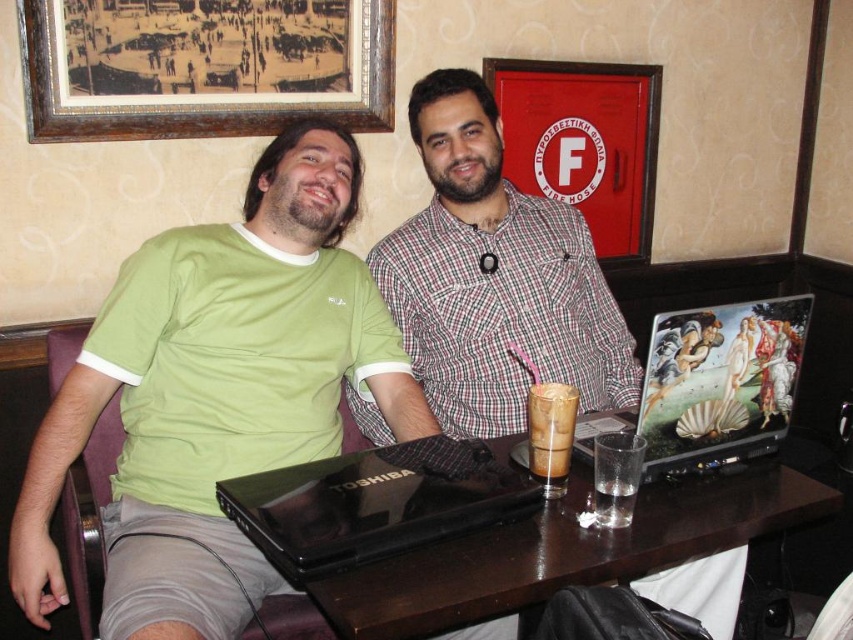
Is black glossy table at center to the right of black glossy laptop at center from the viewer's perspective?

Yes, black glossy table at center is to the right of black glossy laptop at center.

Is black glossy table at center above black glossy laptop at center?

Actually, black glossy table at center is below black glossy laptop at center.

At what (x,y) coordinates should I click in order to perform the action: click on black glossy table at center. Please return your answer as a coordinate pair (x, y). Image resolution: width=853 pixels, height=640 pixels. Looking at the image, I should click on (479, 531).

Based on the photo, who is higher up, wooden framed print at upper left or red matte fire hose cabinet at upper center?

wooden framed print at upper left is above.

This screenshot has height=640, width=853. Identify the location of wooden framed print at upper left. (202, 67).

Does matte plaid shirt at center have a greater width compared to metallic glossy laptop at center?

Yes, matte plaid shirt at center is wider than metallic glossy laptop at center.

Does matte plaid shirt at center appear over metallic glossy laptop at center?

Yes.

Is point (468, 273) more distant than point (735, 460)?

Yes.

Locate an element on the screen. This screenshot has width=853, height=640. matte plaid shirt at center is located at coordinates (495, 276).